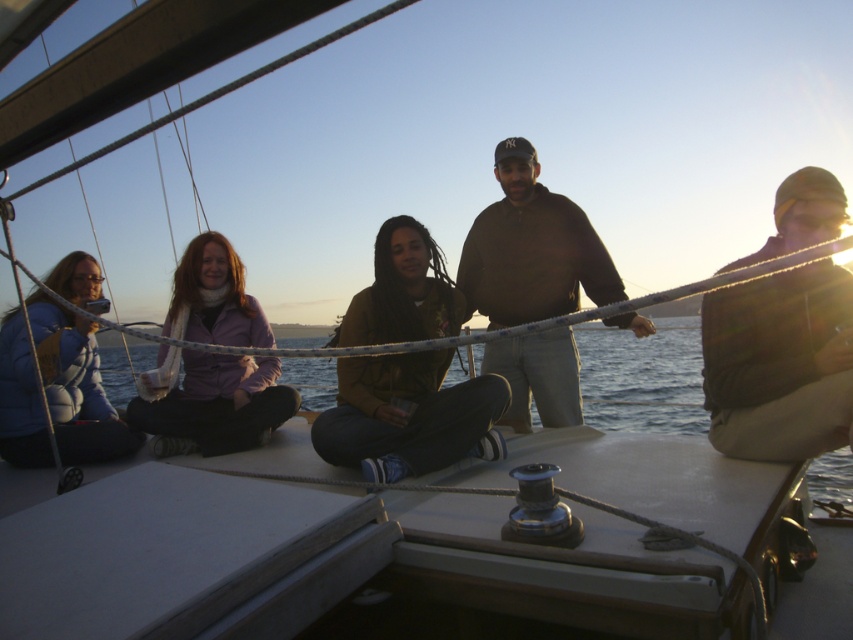
Does point (428, 333) lie in front of point (85, 362)?

Yes, it is in front of point (85, 362).

Can you confirm if brown matte jacket at center is positioned to the right of matte blue jacket at left?

Indeed, brown matte jacket at center is positioned on the right side of matte blue jacket at left.

Identify the location of brown matte jacket at center. The image size is (853, 640). (408, 417).

The image size is (853, 640). I want to click on brown matte jacket at center, so click(x=408, y=417).

Is matte purple sweater at center closer to camera compared to clear blue water at center?

No, matte purple sweater at center is further to the viewer.

Is matte purple sweater at center below clear blue water at center?

Actually, matte purple sweater at center is above clear blue water at center.

Between point (163, 388) and point (660, 320), which one is positioned behind?

Point (660, 320)

Locate an element on the screen. This screenshot has height=640, width=853. matte purple sweater at center is located at coordinates (215, 401).

Who is positioned more to the right, brown matte jacket at center or matte purple sweater at center?

brown matte jacket at center is more to the right.

Looking at this image, measure the distance between point (399, 337) and camera.

Point (399, 337) and camera are 3.06 meters apart.

Find the location of a particular element. The width and height of the screenshot is (853, 640). brown matte jacket at center is located at coordinates (408, 417).

Find the location of `brown matte jacket at center`. brown matte jacket at center is located at coordinates coord(408,417).